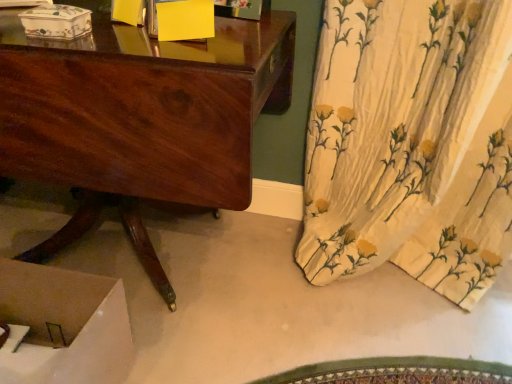
Locate an element on the screen. This screenshot has width=512, height=384. free space to the left of yellow paper at upper center, placed as the 3th box when sorted from left to right is located at coordinates (105, 40).